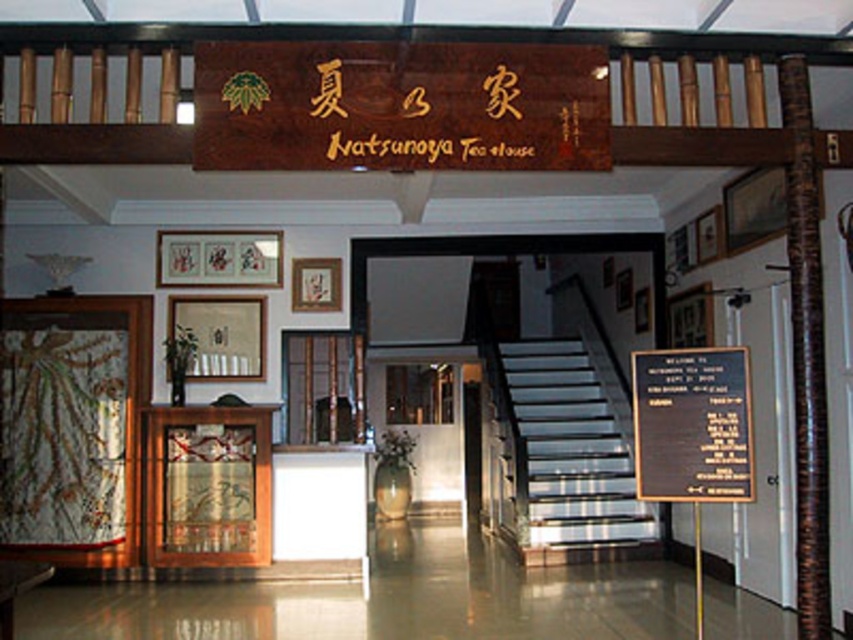
Is point (537, 512) farther from viewer compared to point (741, 404)?

Yes, it is.

Is metallic staircase at center smaller than black wood sign at center?

Actually, metallic staircase at center might be larger than black wood sign at center.

Is point (573, 456) positioned before point (669, 483)?

No, (573, 456) is further to viewer.

Where is `metallic staircase at center`? metallic staircase at center is located at coordinates (572, 445).